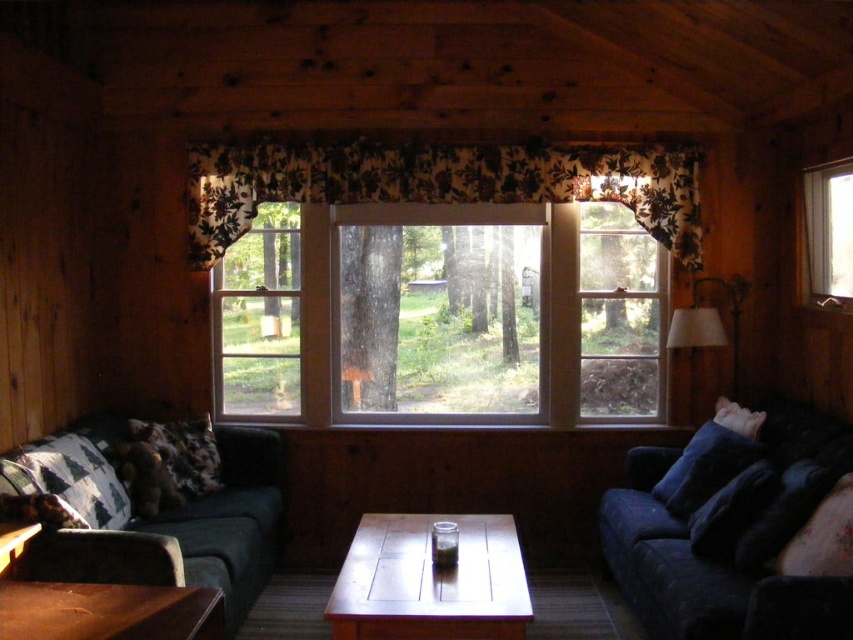
Which is above, dark blue fabric couch at right or green fabric couch at left?

green fabric couch at left is higher up.

Can you confirm if dark blue fabric couch at right is positioned to the right of green fabric couch at left?

Correct, you'll find dark blue fabric couch at right to the right of green fabric couch at left.

Is point (701, 620) less distant than point (73, 490)?

Yes, point (701, 620) is in front of point (73, 490).

Find the location of a particular element. This screenshot has width=853, height=640. dark blue fabric couch at right is located at coordinates pos(730,529).

Does wooden table at center appear under velvety dark blue pillow at lower right?

Yes, wooden table at center is below velvety dark blue pillow at lower right.

Identify the location of wooden table at center. (430, 580).

Which of these two, dark blue fabric couch at right or blue fabric pillow at lower right, stands taller?

dark blue fabric couch at right

Is point (849, 474) less distant than point (693, 436)?

Yes, it is in front of point (693, 436).

The width and height of the screenshot is (853, 640). Find the location of `dark blue fabric couch at right`. dark blue fabric couch at right is located at coordinates (730, 529).